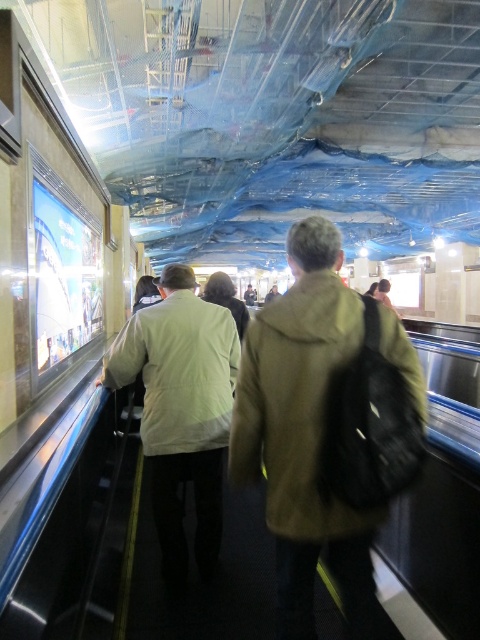
Question: Among these objects, which one is farthest from the camera?

Choices:
 (A) brown woolen jacket at center
 (B) light beige jacket at center

Answer: (B)

Question: Does brown woolen jacket at center appear under light beige jacket at center?

Choices:
 (A) no
 (B) yes

Answer: (A)

Question: Can you confirm if brown woolen jacket at center is positioned to the left of light beige jacket at center?

Choices:
 (A) yes
 (B) no

Answer: (B)

Question: Is brown woolen jacket at center further to camera compared to light beige jacket at center?

Choices:
 (A) yes
 (B) no

Answer: (B)